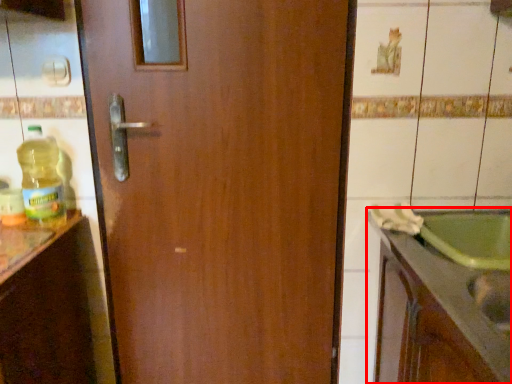
Question: From the image, what is the correct spatial relationship of countertop (annotated by the red box) in relation to bottle?

Choices:
 (A) left
 (B) right

Answer: (B)